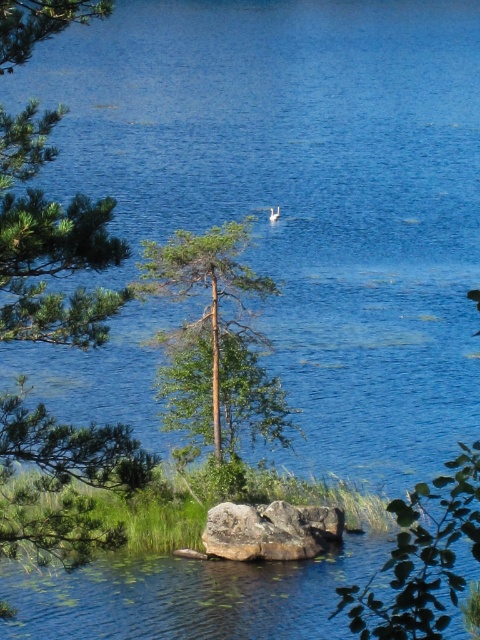
You are standing at the lakeside and want to pick a leaf from the green leafy tree at left and place it on the brown rough rock at center. Which object is closer to your current position?

The green leafy tree at left is closer to the viewer than the brown rough rock at center, so you can reach the green leafy tree at left first.

You are an environmental scientist assessing the lake ecosystem. You observe the green leafy tree at center and the brown rough rock at center. Which object is taller in the scene?

The brown rough rock at center is taller than the green leafy tree at center.

You are a bird looking for a nesting spot. You see two trees in the image, the green leafy tree at left and the green leafy tree at center. Which tree would you choose for nesting if you prefer a taller tree?

The green leafy tree at left is taller than the green leafy tree at center, so the bird would choose the green leafy tree at left for nesting.